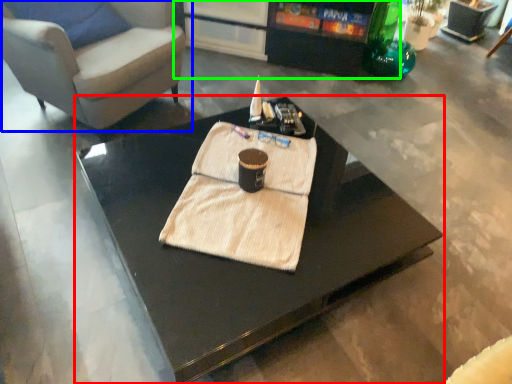
Question: Which is nearer to the coffee table (highlighted by a red box)? chair (highlighted by a blue box) or entertainment center (highlighted by a green box).

Choices:
 (A) chair
 (B) entertainment center

Answer: (A)